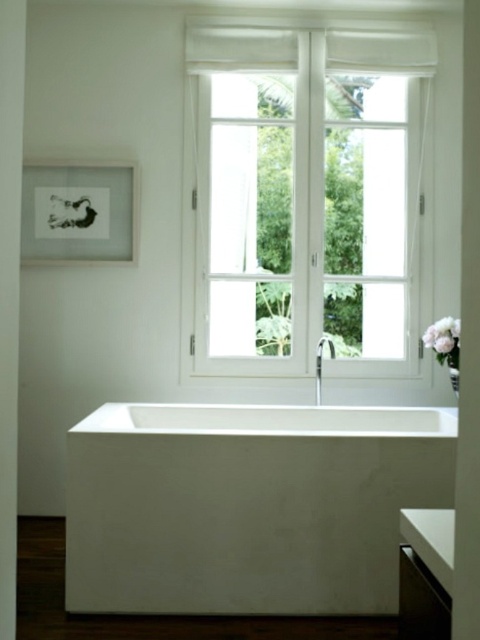
You are a delivery person who needs to place a new white matte flower at right on the bathroom shelf. The current white smooth bathtub at center is occupying most of the space. Is there enough room for the flower?

The white smooth bathtub at center is larger than the white matte flower at right, so there should be enough space to place the flower on the shelf as long as the shelf is not already full.

You are standing in the bathroom and want to reach the framed artwork on the left side of the window. The framed artwork is located at point (331, 131). If you are 4.98 meters away from this point, is the framed artwork within your immediate reach?

The framed artwork at point (331, 131) is 4.98 meters away from you, so it is not within your immediate reach.

You are a painter standing in the bathroom and want to paint the white smooth bathtub at center and the white matte flower at right. Which object should you look down at to paint?

The white smooth bathtub at center is located below the white matte flower at right, so you should look down at the white smooth bathtub at center to paint it while looking straight at the white matte flower at right.